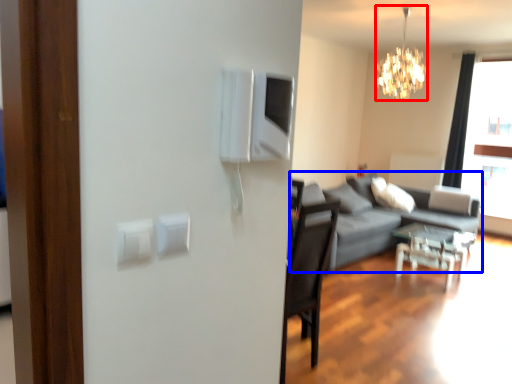
Question: Which point is further to the camera, lamp (highlighted by a red box) or studio couch (highlighted by a blue box)?

Choices:
 (A) lamp
 (B) studio couch

Answer: (B)